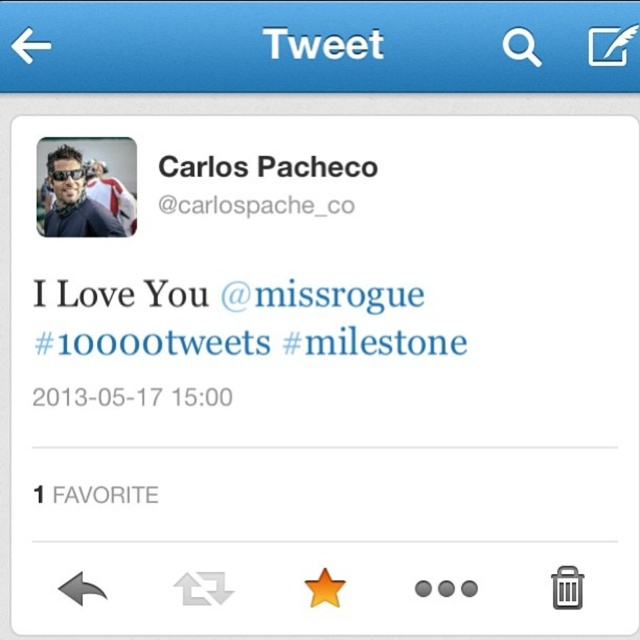
Question: Which object is positioned farthest from the black text at upper center?

Choices:
 (A) sunglasses at upper left
 (B) blue text tweet at center

Answer: (B)

Question: Which point is farther from the camera taking this photo?

Choices:
 (A) (298, 164)
 (B) (51, 209)
 (C) (76, 296)

Answer: (A)

Question: Does blue text tweet at center have a lesser width compared to sunglasses at upper left?

Choices:
 (A) no
 (B) yes

Answer: (A)

Question: Which of these objects is positioned farthest from the black text at upper center?

Choices:
 (A) blue text tweet at center
 (B) sunglasses at upper left

Answer: (A)

Question: Can you confirm if blue text tweet at center is positioned to the left of black text at upper center?

Choices:
 (A) no
 (B) yes

Answer: (B)

Question: Can you confirm if blue text tweet at center is positioned below sunglasses at upper left?

Choices:
 (A) yes
 (B) no

Answer: (A)